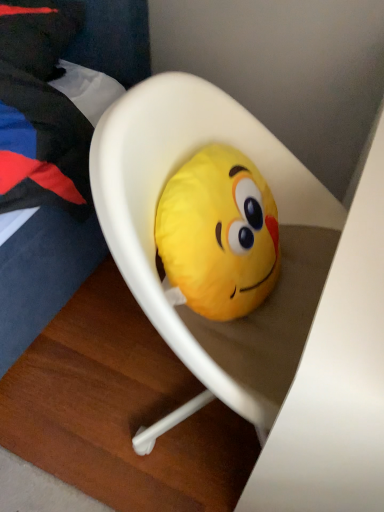
Based on the photo, measure the distance between soft yellow plush at center and camera.

The distance of soft yellow plush at center from camera is 65.35 centimeters.

What do you see at coordinates (218, 234) in the screenshot?
I see `soft yellow plush at center` at bounding box center [218, 234].

Find the location of a particular element. The image size is (384, 512). soft yellow plush at center is located at coordinates (218, 234).

Identify the location of white plastic chair at center. The height and width of the screenshot is (512, 384). (155, 248).

What do you see at coordinates (155, 248) in the screenshot? This screenshot has height=512, width=384. I see `white plastic chair at center` at bounding box center [155, 248].

Image resolution: width=384 pixels, height=512 pixels. Find the location of `soft yellow plush at center`. soft yellow plush at center is located at coordinates (218, 234).

Which object is positioned more to the right, soft yellow plush at center or white plastic chair at center?

white plastic chair at center is more to the right.

Is the position of soft yellow plush at center less distant than that of white plastic chair at center?

That is False.

Is point (195, 160) positioned behind point (111, 237)?

Yes, point (195, 160) is behind point (111, 237).

From the image's perspective, does soft yellow plush at center appear lower than white plastic chair at center?

Incorrect, from the image's perspective, soft yellow plush at center is higher than white plastic chair at center.

From a real-world perspective, which is physically above, soft yellow plush at center or white plastic chair at center?

soft yellow plush at center is physically above.

Does soft yellow plush at center have a greater width compared to white plastic chair at center?

In fact, soft yellow plush at center might be narrower than white plastic chair at center.

Considering the sizes of soft yellow plush at center and white plastic chair at center in the image, is soft yellow plush at center taller or shorter than white plastic chair at center?

Considering their sizes, soft yellow plush at center has less height than white plastic chair at center.

Considering the sizes of objects soft yellow plush at center and white plastic chair at center in the image provided, who is smaller, soft yellow plush at center or white plastic chair at center?

soft yellow plush at center.

Looking at this image, is soft yellow plush at center outside of white plastic chair at center?

No.

Is soft yellow plush at center positioned far away from white plastic chair at center?

They are positioned close to each other.

Does soft yellow plush at center turn towards white plastic chair at center?

Yes.

How many degrees apart are the facing directions of soft yellow plush at center and white plastic chair at center?

They differ by 2.35 degrees in their facing directions.

Where is `furniture in front of the soft yellow plush at center`? This screenshot has height=512, width=384. furniture in front of the soft yellow plush at center is located at coordinates click(x=155, y=248).

Which is more to the right, white plastic chair at center or soft yellow plush at center?

Answer: white plastic chair at center.

Is the position of white plastic chair at center less distant than that of soft yellow plush at center?

That is True.

Is point (240, 382) positioned behind point (163, 193)?

No, (240, 382) is in front of (163, 193).

From the image's perspective, which is below, white plastic chair at center or soft yellow plush at center?

white plastic chair at center is shown below in the image.

From a real-world perspective, who is located higher, white plastic chair at center or soft yellow plush at center?

soft yellow plush at center, from a real-world perspective.

Does white plastic chair at center have a greater width compared to soft yellow plush at center?

Indeed, white plastic chair at center has a greater width compared to soft yellow plush at center.

Who is shorter, white plastic chair at center or soft yellow plush at center?

With less height is soft yellow plush at center.

Considering the sizes of objects white plastic chair at center and soft yellow plush at center in the image provided, who is bigger, white plastic chair at center or soft yellow plush at center?

white plastic chair at center.

Based on the photo, is white plastic chair at center situated inside soft yellow plush at center or outside?

white plastic chair at center is located beyond the bounds of soft yellow plush at center.

Would you say white plastic chair at center is a long distance from soft yellow plush at center?

white plastic chair at center is actually quite close to soft yellow plush at center.

Is white plastic chair at center facing away from soft yellow plush at center?

Yes.

How many degrees apart are the facing directions of white plastic chair at center and soft yellow plush at center?

2.35 degrees.

How much distance is there between white plastic chair at center and soft yellow plush at center?

3.76 inches.

This screenshot has width=384, height=512. What are the coordinates of `toy behind the white plastic chair at center` in the screenshot? It's located at (218, 234).

There is a white plastic chair at center. Find the location of `toy above it (from a real-world perspective)`. toy above it (from a real-world perspective) is located at coordinates (218, 234).

At what (x,y) coordinates should I click in order to perform the action: click on toy that is behind the white plastic chair at center. Please return your answer as a coordinate pair (x, y). Looking at the image, I should click on (218, 234).